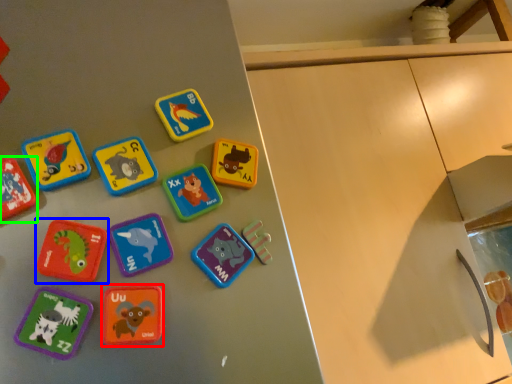
Question: Based on their relative distances, which object is nearer to toy (highlighted by a red box)? Choose from toy (highlighted by a blue box) and toy (highlighted by a green box).

Choices:
 (A) toy
 (B) toy

Answer: (A)